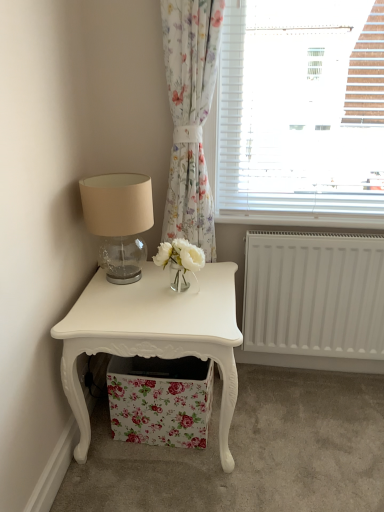
Image resolution: width=384 pixels, height=512 pixels. I want to click on free point above white matte radiator at lower right (from a real-world perspective), so click(x=322, y=230).